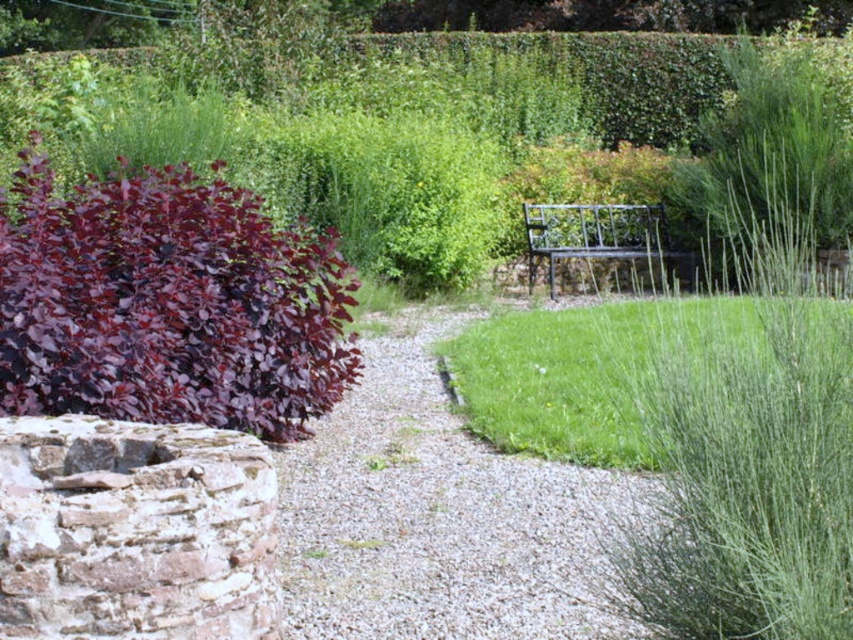
You are planning to install a new sprinkler system in the garden. The sprinkler needs to be placed where it can water both the rustic stone well at lower left and the green grass at center. Based on their positions, where should you place the sprinkler to ensure both areas are covered?

The rustic stone well at lower left is positioned under green grass at center, so placing the sprinkler near the green grass at center would ensure it waters both areas effectively.